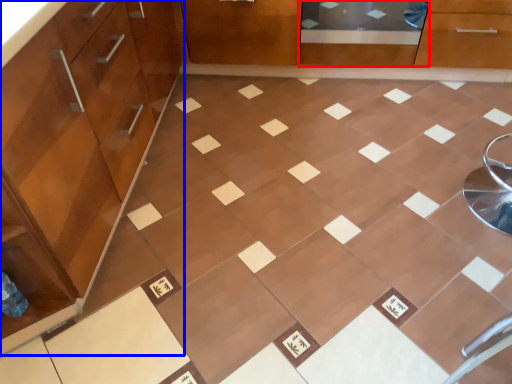
Question: Which object appears farthest to the camera in this image, screen door (highlighted by a red box) or cabinetry (highlighted by a blue box)?

Choices:
 (A) screen door
 (B) cabinetry

Answer: (A)